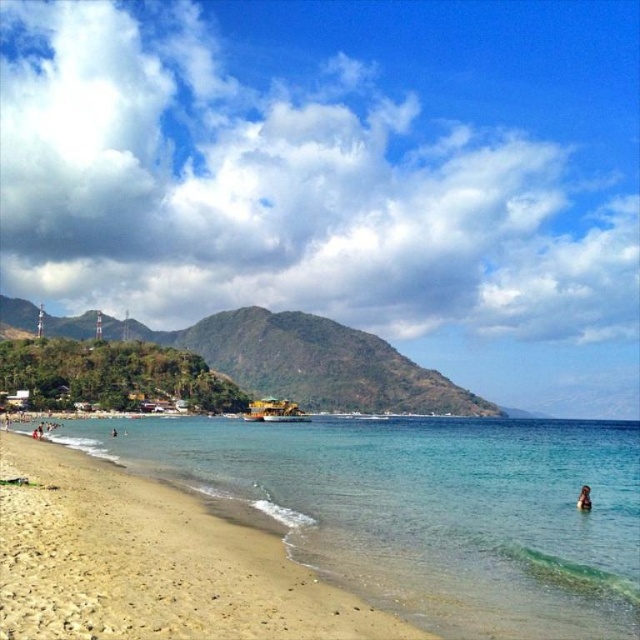
You are standing at the point marked by the coordinates point (150, 563). Looking towards the direction of the small boat with a yellow roof anchored near the center, which direction should you walk to reach the boat?

The point (150, 563) is located at the light brown sand at lower left. Since the boat is anchored near the center of the image, you should walk towards the center from the lower left position, which would be in the north or northeast direction.